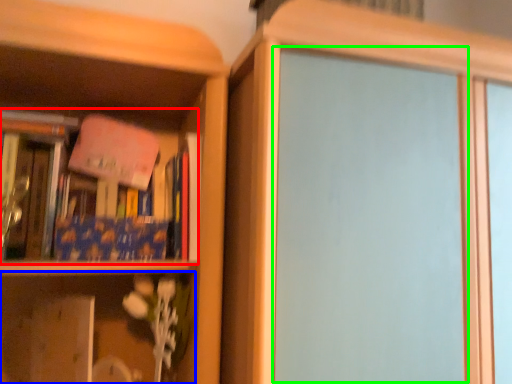
Question: Estimate the real-world distances between objects in this image. Which object is closer to book (highlighted by a red box), shelf (highlighted by a blue box) or screen door (highlighted by a green box)?

Choices:
 (A) shelf
 (B) screen door

Answer: (A)